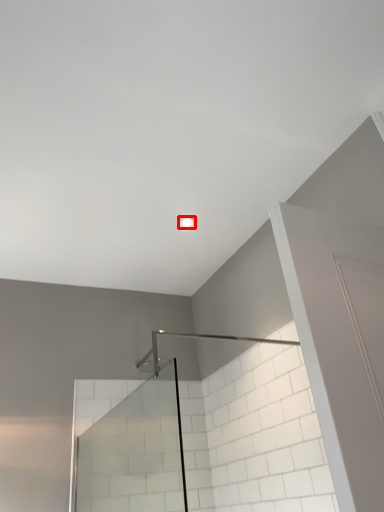
Question: Where is light fixture (annotated by the red box) located in relation to glass door in the image?

Choices:
 (A) left
 (B) right

Answer: (B)